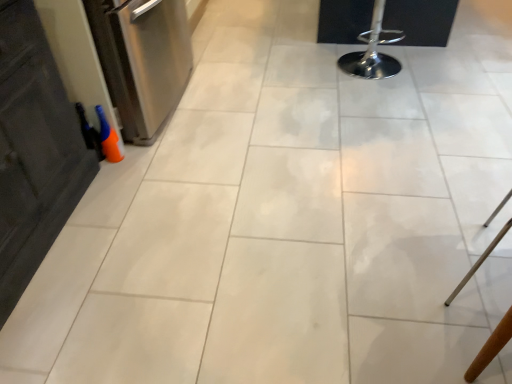
Where is `free region on the left part of wooden chair at lower right`? This screenshot has width=512, height=384. free region on the left part of wooden chair at lower right is located at coordinates (409, 266).